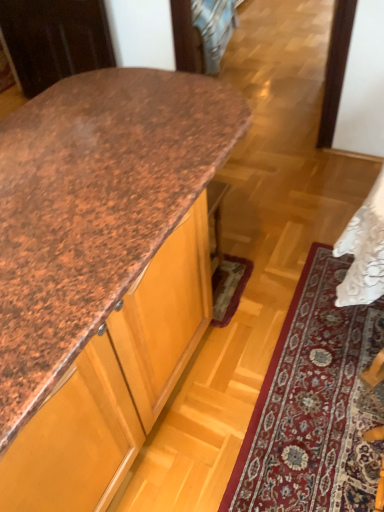
Where is `carpet with intricate patterns at lower right`? The image size is (384, 512). carpet with intricate patterns at lower right is located at coordinates (315, 405).

What do you see at coordinates (315, 405) in the screenshot? The height and width of the screenshot is (512, 384). I see `carpet with intricate patterns at lower right` at bounding box center [315, 405].

Locate an element on the screen. The image size is (384, 512). brown speckled laminate countertop at upper left is located at coordinates (101, 272).

The image size is (384, 512). Describe the element at coordinates (101, 272) in the screenshot. I see `brown speckled laminate countertop at upper left` at that location.

At what (x,y) coordinates should I click in order to perform the action: click on carpet with intricate patterns at lower right. Please return your answer as a coordinate pair (x, y). Looking at the image, I should click on (315, 405).

In the image, is brown speckled laminate countertop at upper left on the left side or the right side of carpet with intricate patterns at lower right?

From the image, it's evident that brown speckled laminate countertop at upper left is to the left of carpet with intricate patterns at lower right.

Considering the relative positions of brown speckled laminate countertop at upper left and carpet with intricate patterns at lower right in the image provided, is brown speckled laminate countertop at upper left behind carpet with intricate patterns at lower right?

No.

Considering the points (0, 479) and (323, 373), which point is behind, point (0, 479) or point (323, 373)?

Positioned behind is point (323, 373).

From the image's perspective, is brown speckled laminate countertop at upper left located beneath carpet with intricate patterns at lower right?

Actually, brown speckled laminate countertop at upper left appears above carpet with intricate patterns at lower right in the image.

From a real-world perspective, is brown speckled laminate countertop at upper left located beneath carpet with intricate patterns at lower right?

Incorrect, from a real-world perspective, brown speckled laminate countertop at upper left is higher than carpet with intricate patterns at lower right.

Considering the relative sizes of brown speckled laminate countertop at upper left and carpet with intricate patterns at lower right in the image provided, is brown speckled laminate countertop at upper left wider than carpet with intricate patterns at lower right?

Yes.

In terms of height, does brown speckled laminate countertop at upper left look taller or shorter compared to carpet with intricate patterns at lower right?

Considering their sizes, brown speckled laminate countertop at upper left has more height than carpet with intricate patterns at lower right.

Consider the image. Between brown speckled laminate countertop at upper left and carpet with intricate patterns at lower right, which one has larger size?

With larger size is brown speckled laminate countertop at upper left.

Is brown speckled laminate countertop at upper left inside the boundaries of carpet with intricate patterns at lower right, or outside?

brown speckled laminate countertop at upper left is outside carpet with intricate patterns at lower right.

Would you consider brown speckled laminate countertop at upper left to be distant from carpet with intricate patterns at lower right?

brown speckled laminate countertop at upper left is near carpet with intricate patterns at lower right, not far away.

Is carpet with intricate patterns at lower right at the back of brown speckled laminate countertop at upper left?

No.

How different are the orientations of brown speckled laminate countertop at upper left and carpet with intricate patterns at lower right in degrees?

The facing directions of brown speckled laminate countertop at upper left and carpet with intricate patterns at lower right are 177 degrees apart.

Where is `countertop located in front of the carpet with intricate patterns at lower right`? The image size is (384, 512). countertop located in front of the carpet with intricate patterns at lower right is located at coordinates (101, 272).

Based on the photo, considering the relative positions of carpet with intricate patterns at lower right and brown speckled laminate countertop at upper left in the image provided, is carpet with intricate patterns at lower right to the right of brown speckled laminate countertop at upper left from the viewer's perspective?

Yes, carpet with intricate patterns at lower right is to the right of brown speckled laminate countertop at upper left.

Is carpet with intricate patterns at lower right closer to camera compared to brown speckled laminate countertop at upper left?

No, carpet with intricate patterns at lower right is behind brown speckled laminate countertop at upper left.

Which is farther, [297,463] or [106,407]?

The point [297,463] is farther from the camera.

From the image's perspective, which one is positioned higher, carpet with intricate patterns at lower right or brown speckled laminate countertop at upper left?

brown speckled laminate countertop at upper left.

From a real-world perspective, is carpet with intricate patterns at lower right physically located above or below brown speckled laminate countertop at upper left?

carpet with intricate patterns at lower right is situated lower than brown speckled laminate countertop at upper left in the real world.

Is carpet with intricate patterns at lower right wider than brown speckled laminate countertop at upper left?

Incorrect, the width of carpet with intricate patterns at lower right does not surpass that of brown speckled laminate countertop at upper left.

Who is shorter, carpet with intricate patterns at lower right or brown speckled laminate countertop at upper left?

With less height is carpet with intricate patterns at lower right.

Who is smaller, carpet with intricate patterns at lower right or brown speckled laminate countertop at upper left?

Smaller between the two is carpet with intricate patterns at lower right.

Is brown speckled laminate countertop at upper left completely or partially inside carpet with intricate patterns at lower right?

No, brown speckled laminate countertop at upper left is not surrounded by carpet with intricate patterns at lower right.

Is carpet with intricate patterns at lower right directly adjacent to brown speckled laminate countertop at upper left?

They are not placed beside each other.

Is carpet with intricate patterns at lower right turned away from brown speckled laminate countertop at upper left?

No, carpet with intricate patterns at lower right is not facing away from brown speckled laminate countertop at upper left.

Image resolution: width=384 pixels, height=512 pixels. I want to click on mat that is below the brown speckled laminate countertop at upper left (from the image's perspective), so click(x=315, y=405).

You are a GUI agent. You are given a task and a screenshot of the screen. Output one action in this format:
    pyautogui.click(x=<x>, y=<y>)
    Task: Click on the countertop located above the carpet with intricate patterns at lower right (from a real-world perspective)
    This screenshot has height=512, width=384.
    Given the screenshot: What is the action you would take?
    pyautogui.click(x=101, y=272)

The width and height of the screenshot is (384, 512). Identify the location of mat behind the brown speckled laminate countertop at upper left. (315, 405).